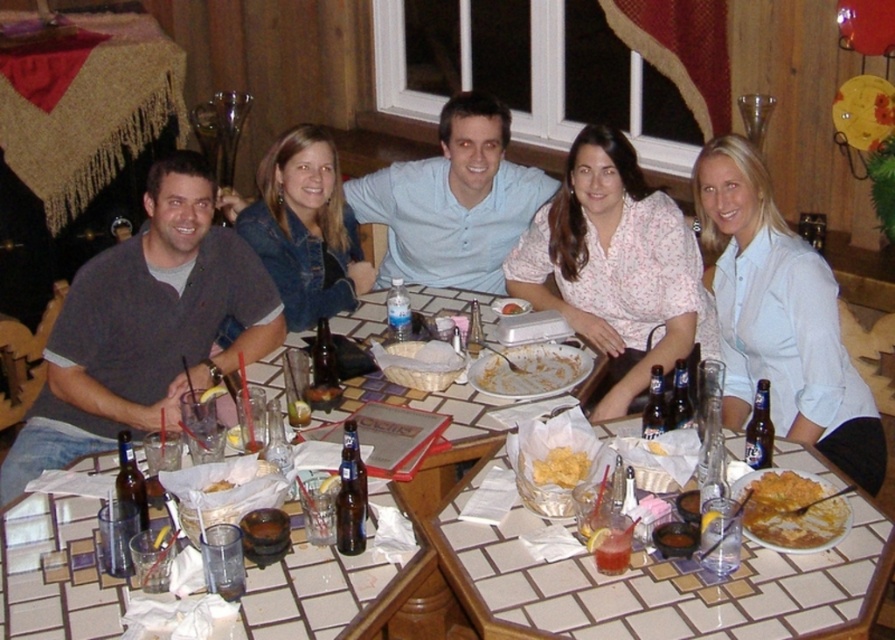
Who is lower down, light blue button-down shirt at center or golden crispy tortilla at center?

golden crispy tortilla at center

Between light blue button-down shirt at center and golden crispy tortilla at center, which one appears on the left side from the viewer's perspective?

light blue button-down shirt at center

Does point (526, 173) come closer to viewer compared to point (817, 477)?

No.

This screenshot has height=640, width=895. Identify the location of light blue button-down shirt at center. (453, 202).

Can you confirm if white floral blouse at center is positioned to the right of brown glass bottle at table center?

Indeed, white floral blouse at center is positioned on the right side of brown glass bottle at table center.

Between white floral blouse at center and brown glass bottle at table center, which one has more height?

With more height is white floral blouse at center.

Who is more forward, (573, 154) or (363, 484)?

Point (363, 484) is more forward.

Find the location of a particular element. The image size is (895, 640). white floral blouse at center is located at coordinates (616, 266).

Is brown glass bottle at table center shorter than yellow crispy chips at center?

Incorrect, brown glass bottle at table center's height does not fall short of yellow crispy chips at center's.

Is point (360, 534) positioned before point (578, 481)?

Yes, it is in front of point (578, 481).

Who is more forward, (348,484) or (573,451)?

Positioned in front is point (348,484).

Find the location of a particular element. brown glass bottle at table center is located at coordinates (350, 496).